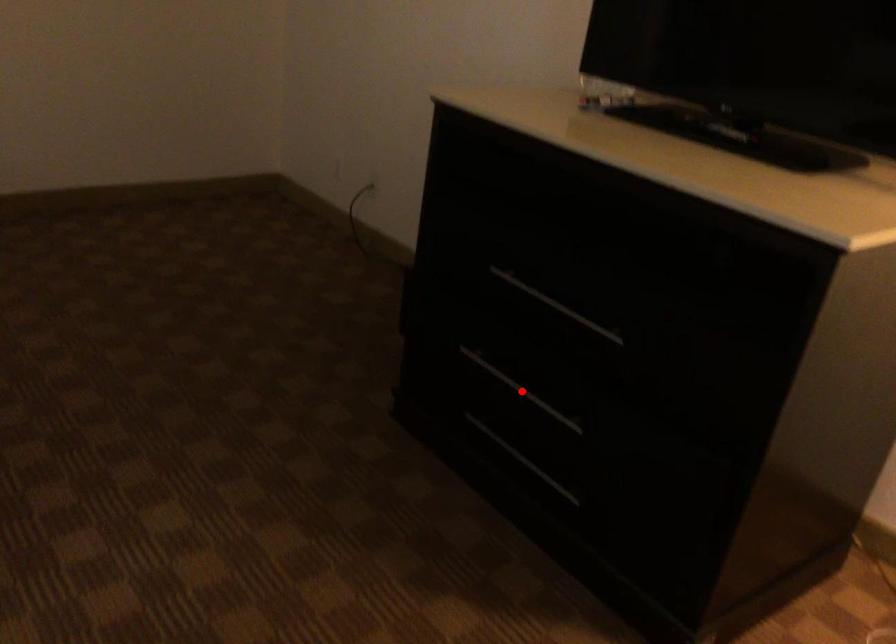
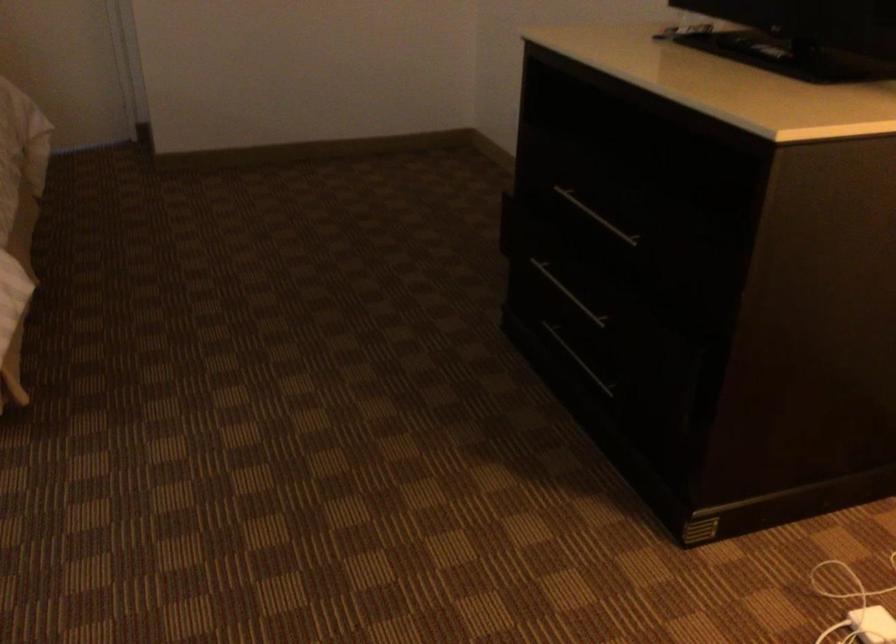
In the second image, find the point that corresponds to the highlighted location in the first image.

(567, 292)